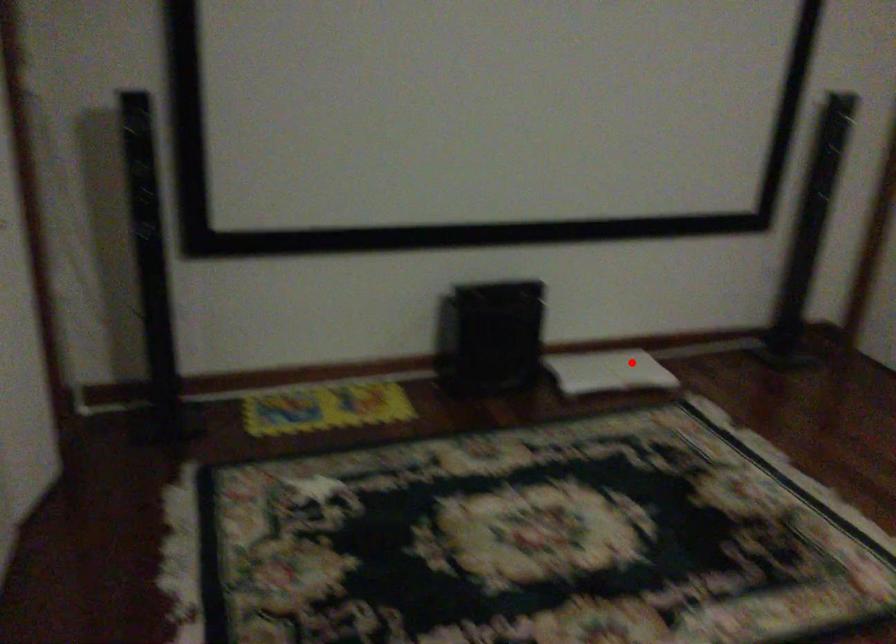
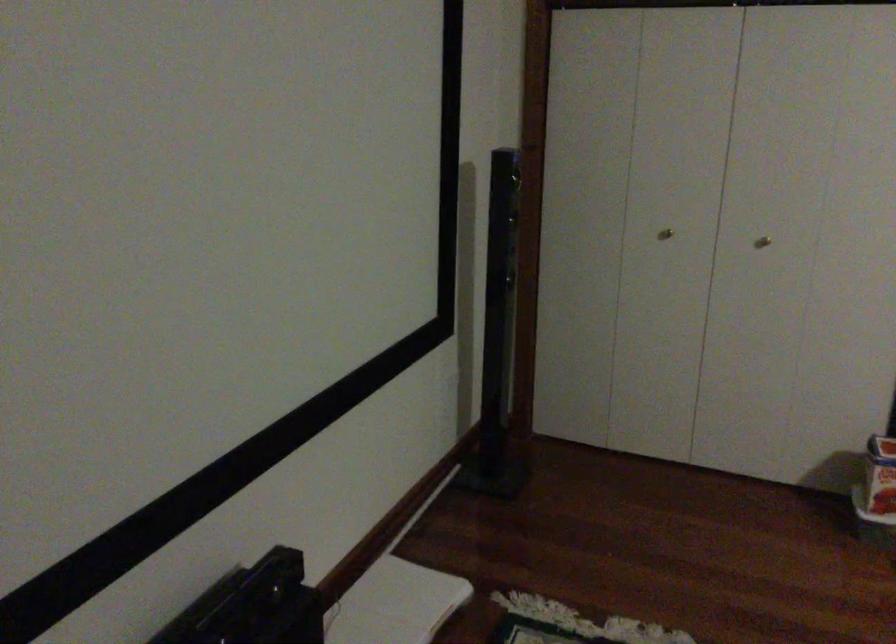
Question: I am providing you with two images of the same scene from different viewpoints. Image1 has a red point marked. In image2, the corresponding 3D location appears at what relative position? Reply with the corresponding letter.

Choices:
 (A) Closer
 (B) Farther

Answer: (A)